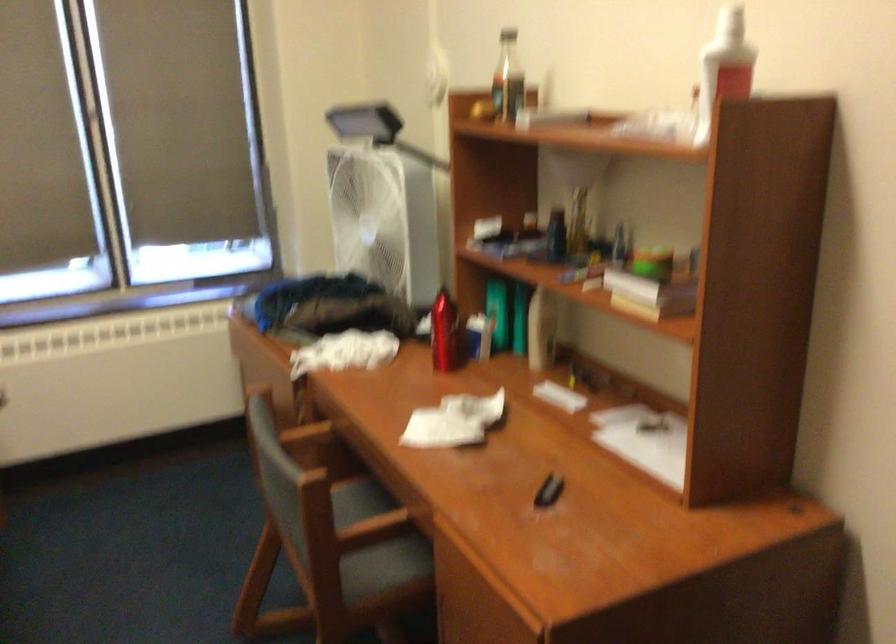
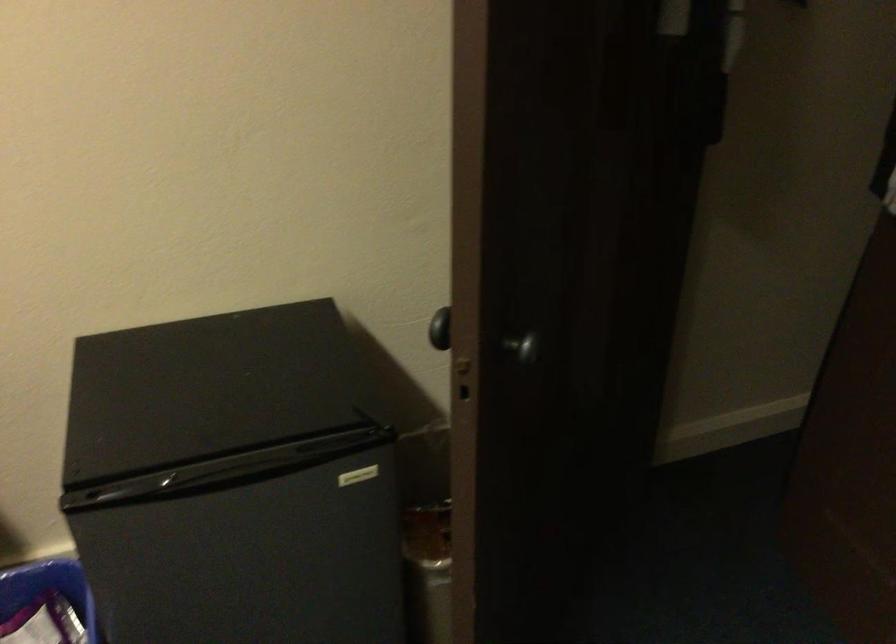
From the picture: First-person continuous shooting, in which direction is the camera rotating?

The camera's rotation is toward right-down.